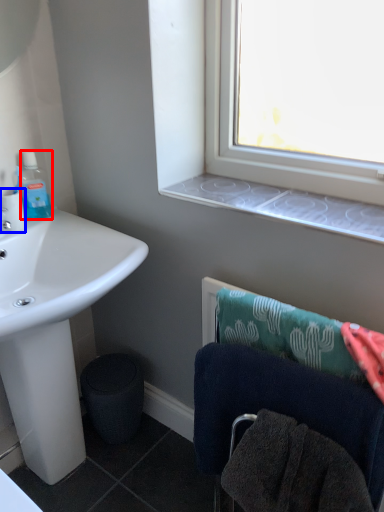
Question: Which object appears closest to the camera in this image, bottle (highlighted by a red box) or coffee cup (highlighted by a blue box)?

Choices:
 (A) bottle
 (B) coffee cup

Answer: (B)